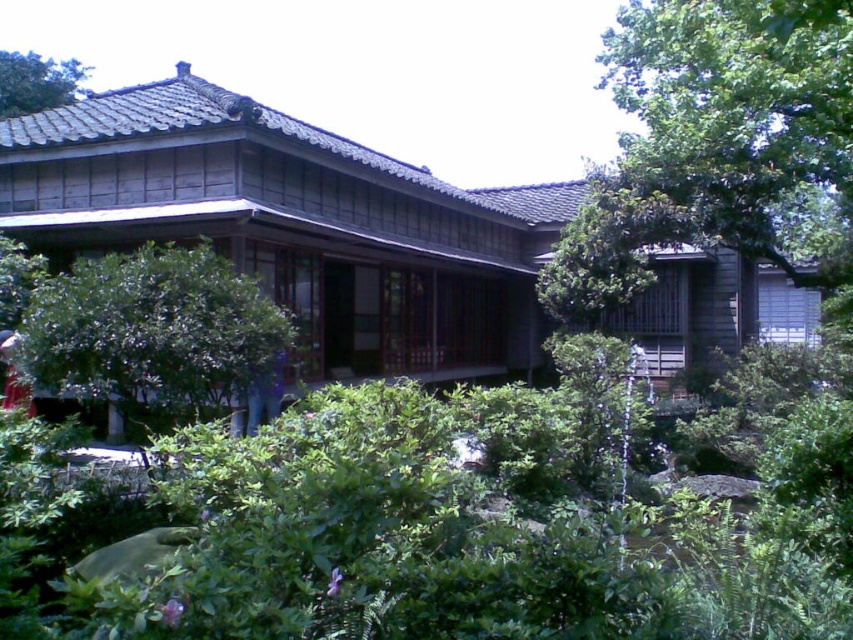
You are a visitor standing at the entrance of the traditional building. You notice a green leafy bush at center and a green leafy tree at upper left. Which of these two plants is closer to you?

The green leafy bush at center is closer to you because it is in front of the green leafy tree at upper left.

You are standing in front of the traditional East Asian building in the image. There are two points marked on the building facade. The first point is at coordinate point(149,304) and the second is at point(15,83). Which point is closer to you?

Point(149,304) is closer to the viewer than point0.130, 0.18.

You are standing at the entrance of the traditional building and want to place a decorative stone in the exact center of the garden. The garden is a perfect square with coordinates from 0 to 1 on both axes. According to the image, where should you place the stone relative to the green leafy bush at center?

The green leafy bush at center is located at coordinates point (149, 332), so the exact center of the garden would be at point (426, 320). Therefore, the decorative stone should be placed slightly to the upper left of the green leafy bush at center to reach the center point.